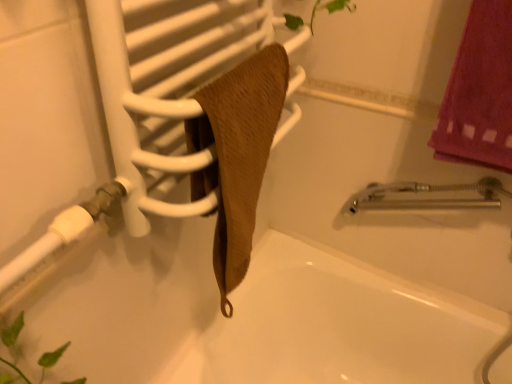
Locate an element on the screen. This screenshot has height=384, width=512. brown textured towel at center is located at coordinates (165, 85).

The height and width of the screenshot is (384, 512). Describe the element at coordinates (337, 326) in the screenshot. I see `white matte bathtub at center` at that location.

This screenshot has width=512, height=384. What do you see at coordinates (237, 154) in the screenshot?
I see `brown textured towel at center` at bounding box center [237, 154].

Where is `brown textured towel at center`? The image size is (512, 384). brown textured towel at center is located at coordinates (165, 85).

From the image's perspective, is brown textured towel at center positioned above or below white matte shower at lower left?

brown textured towel at center is situated higher than white matte shower at lower left in the image.

From their relative heights in the image, would you say brown textured towel at center is taller or shorter than white matte shower at lower left?

Clearly, brown textured towel at center is taller compared to white matte shower at lower left.

Which of these two, brown textured towel at center or white matte shower at lower left, is thinner?

white matte shower at lower left is thinner.

From the image's perspective, relative to brown textured towel at center, is white matte bathtub at center above or below?

Clearly, from the image's perspective, white matte bathtub at center is below brown textured towel at center.

Consider the image. Between white matte bathtub at center and brown textured towel at center, which one has smaller width?

With smaller width is brown textured towel at center.

Is white matte bathtub at center further to camera compared to brown textured towel at center?

Yes, it is.

Is brown textured towel at center looking in the opposite direction of white matte bathtub at center?

No.

Image resolution: width=512 pixels, height=384 pixels. What are the coordinates of `screen door located on the left of white matte bathtub at center` in the screenshot? It's located at (165, 85).

Which of these two, brown textured towel at center or white matte bathtub at center, is smaller?

brown textured towel at center.

Does point (30, 248) come behind point (296, 257)?

No, (30, 248) is in front of (296, 257).

Is white matte shower at lower left placed right next to white matte bathtub at center?

No, white matte shower at lower left is not in contact with white matte bathtub at center.

Can you confirm if white matte shower at lower left is wider than white matte bathtub at center?

No, white matte shower at lower left is not wider than white matte bathtub at center.

Considering the sizes of objects white matte shower at lower left and white matte bathtub at center in the image provided, who is bigger, white matte shower at lower left or white matte bathtub at center?

white matte bathtub at center.

From the picture: Does white matte bathtub at center turn towards brown textured towel at center?

No, white matte bathtub at center is not facing towards brown textured towel at center.

Consider the image. From a real-world perspective, which object stands above the other?

brown textured towel at center.

Based on the photo, in terms of height, does white matte bathtub at center look taller or shorter compared to brown textured towel at center?

white matte bathtub at center is taller than brown textured towel at center.

From the image's perspective, is white matte bathtub at center beneath brown textured towel at center?

Yes, from the image's perspective, white matte bathtub at center is beneath brown textured towel at center.

Is brown textured towel at center inside brown textured towel at center?

Absolutely, brown textured towel at center is inside brown textured towel at center.

From the image's perspective, between brown textured towel at center and brown textured towel at center, which one is located above?

From the image's view, brown textured towel at center is above.

Considering the relative sizes of brown textured towel at center and white matte bathtub at center in the image provided, is brown textured towel at center wider than white matte bathtub at center?

Incorrect, the width of brown textured towel at center does not surpass that of white matte bathtub at center.

From the image's perspective, is brown textured towel at center under white matte bathtub at center?

Incorrect, from the image's perspective, brown textured towel at center is higher than white matte bathtub at center.

Is brown textured towel at center positioned beyond the bounds of white matte bathtub at center?

Yes, brown textured towel at center is outside of white matte bathtub at center.

Which is behind, point (236, 164) or point (371, 271)?

The point (371, 271) is farther from the camera.

Find the location of `screen door located above the white matte shower at lower left (from a real-world perspective)`. screen door located above the white matte shower at lower left (from a real-world perspective) is located at coordinates (165, 85).

The width and height of the screenshot is (512, 384). What are the coordinates of `bath towel in front of the white matte bathtub at center` in the screenshot? It's located at (237, 154).

Estimate the real-world distances between objects in this image. Which object is closer to brown textured towel at center, white matte shower at lower left or brown textured towel at center?

brown textured towel at center lies closer to brown textured towel at center than the other object.

Which object lies nearer to the anchor point brown textured towel at center, white matte bathtub at center or white matte shower at lower left?

Among the two, white matte shower at lower left is located nearer to brown textured towel at center.

Based on their spatial positions, is brown textured towel at center or brown textured towel at center closer to white matte shower at lower left?

brown textured towel at center is positioned closer to the anchor white matte shower at lower left.

From the image, which object appears to be nearer to white matte shower at lower left, brown textured towel at center or white matte bathtub at center?

brown textured towel at center.

Based on their spatial positions, is white matte shower at lower left or white matte bathtub at center further from brown textured towel at center?

white matte bathtub at center lies further to brown textured towel at center than the other object.

Based on their spatial positions, is brown textured towel at center or white matte shower at lower left further from brown textured towel at center?

The object further to brown textured towel at center is white matte shower at lower left.

Considering their positions, is brown textured towel at center positioned further to brown textured towel at center than white matte bathtub at center?

The object further to brown textured towel at center is white matte bathtub at center.

In the scene shown: Looking at the image, which one is located further to brown textured towel at center, white matte bathtub at center or brown textured towel at center?

Based on the image, white matte bathtub at center appears to be further to brown textured towel at center.

Locate an element on the screen. The height and width of the screenshot is (384, 512). shower that lies between brown textured towel at center and white matte bathtub at center from top to bottom is located at coordinates (62, 234).

The width and height of the screenshot is (512, 384). I want to click on screen door situated between white matte shower at lower left and brown textured towel at center from left to right, so click(x=165, y=85).

Identify the location of shower between brown textured towel at center and white matte bathtub at center vertically. The height and width of the screenshot is (384, 512). (62, 234).

The height and width of the screenshot is (384, 512). I want to click on bath towel between brown textured towel at center and white matte bathtub at center vertically, so click(237, 154).